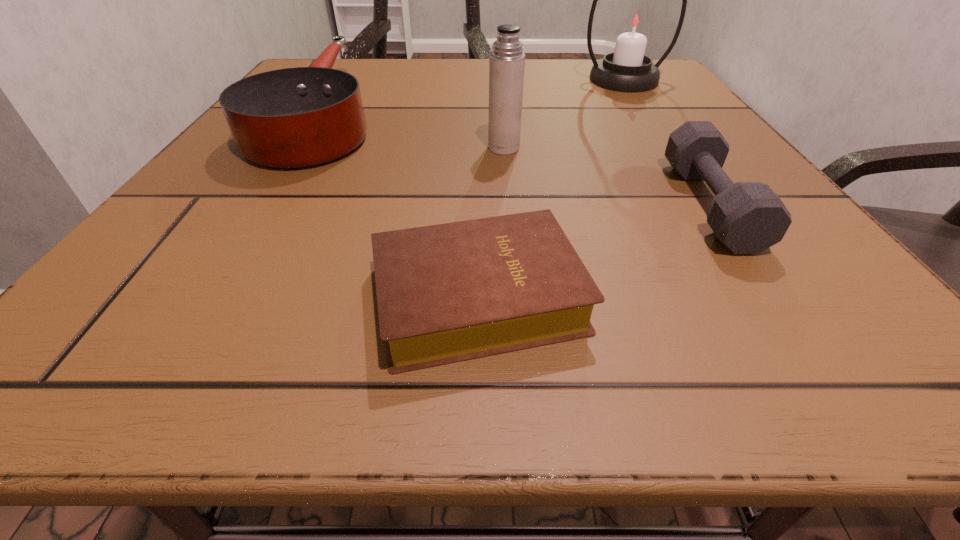
The image size is (960, 540). I want to click on free space located on the front of the dumbbell, so click(806, 348).

Find the location of `free space located 0.080m on the left of the shortest object`. free space located 0.080m on the left of the shortest object is located at coordinates (297, 298).

Identify the location of oil lamp at the far edge. The image size is (960, 540). (635, 22).

Find the location of a particular element. This screenshot has height=540, width=960. pan positioned at the far edge is located at coordinates pyautogui.click(x=298, y=117).

Locate an element on the screen. object that is at the near edge is located at coordinates (446, 293).

What are the coordinates of `object that is positioned at the left edge` in the screenshot? It's located at (298, 117).

The height and width of the screenshot is (540, 960). What are the coordinates of `oil lamp located in the right edge section of the desktop` in the screenshot? It's located at (635, 22).

You are a GUI agent. You are given a task and a screenshot of the screen. Output one action in this format:
    pyautogui.click(x=<x>, y=<y>)
    Task: Click on the dumbbell present at the right edge
    The height and width of the screenshot is (540, 960).
    Given the screenshot: What is the action you would take?
    pyautogui.click(x=747, y=217)

Identify the location of object positioned at the far left corner. This screenshot has width=960, height=540. (298, 117).

The width and height of the screenshot is (960, 540). Find the location of `object present at the far right corner`. object present at the far right corner is located at coordinates (635, 22).